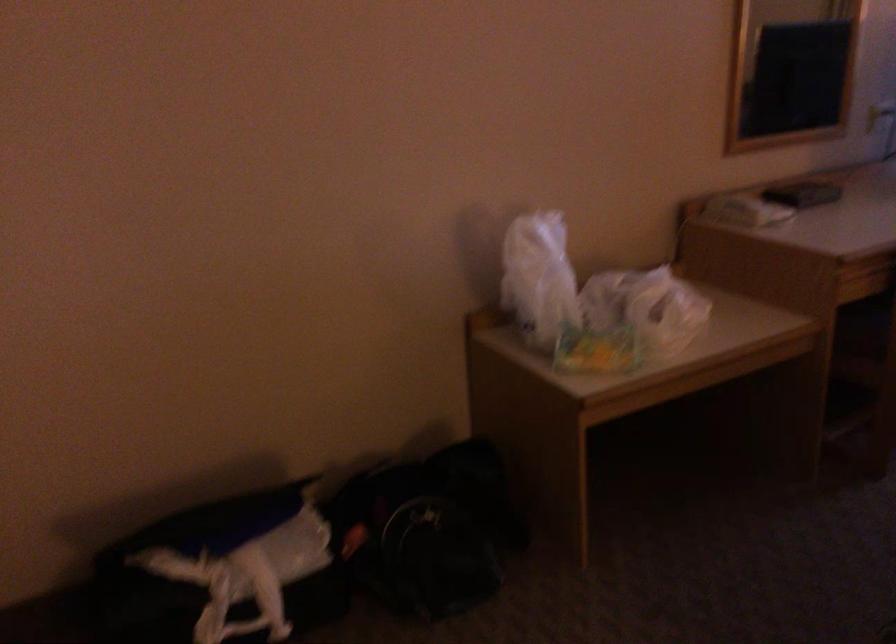
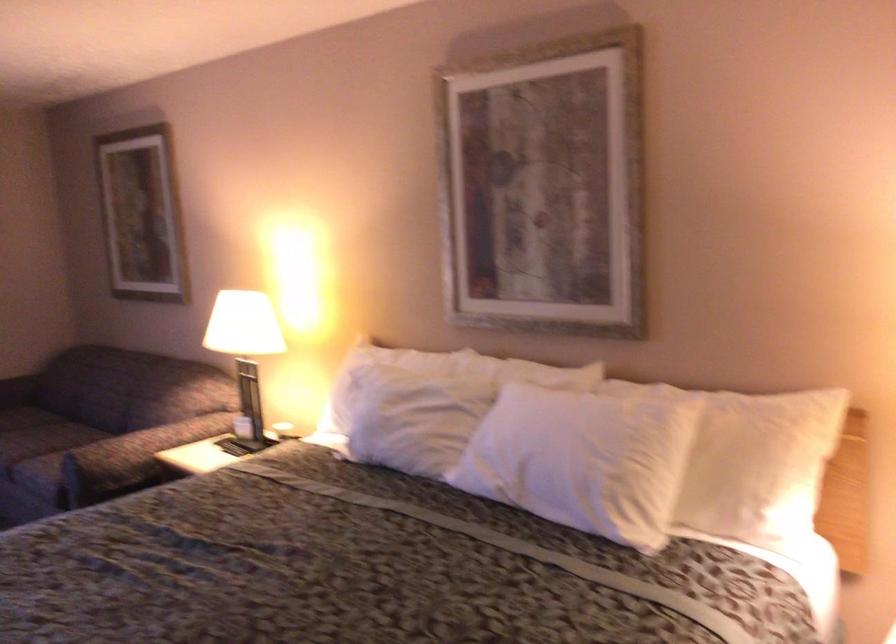
Question: Based on the continuous images, in which direction is the camera rotating? Reply with the corresponding letter.

Choices:
 (A) Left
 (B) Right
 (C) Up
 (D) Down

Answer: (B)